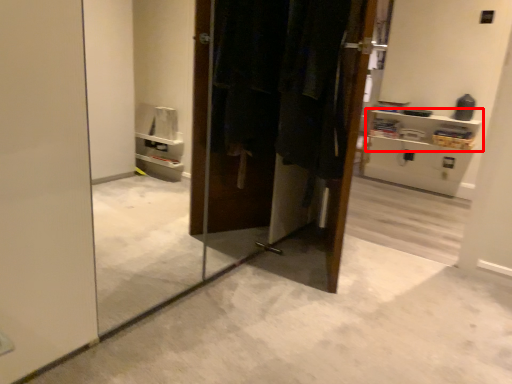
Question: Where is shelf (annotated by the red box) located in relation to laundry in the image?

Choices:
 (A) right
 (B) left

Answer: (A)